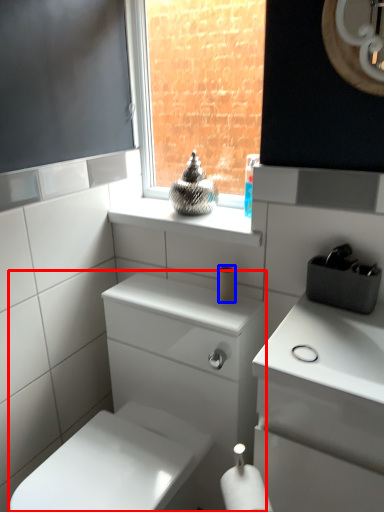
Question: Which object appears closest to the camera in this image, porcelain (highlighted by a red box) or toilet paper (highlighted by a blue box)?

Choices:
 (A) porcelain
 (B) toilet paper

Answer: (A)